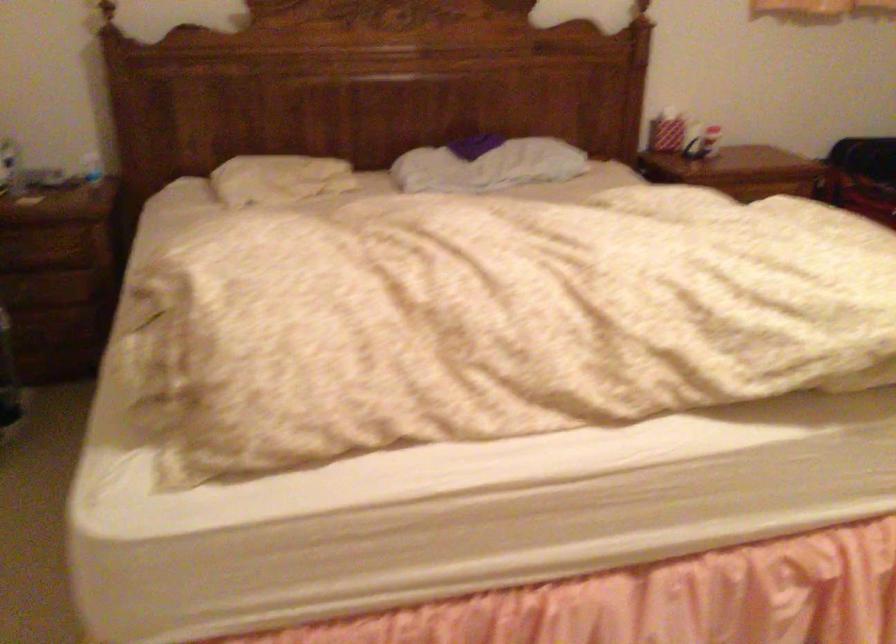
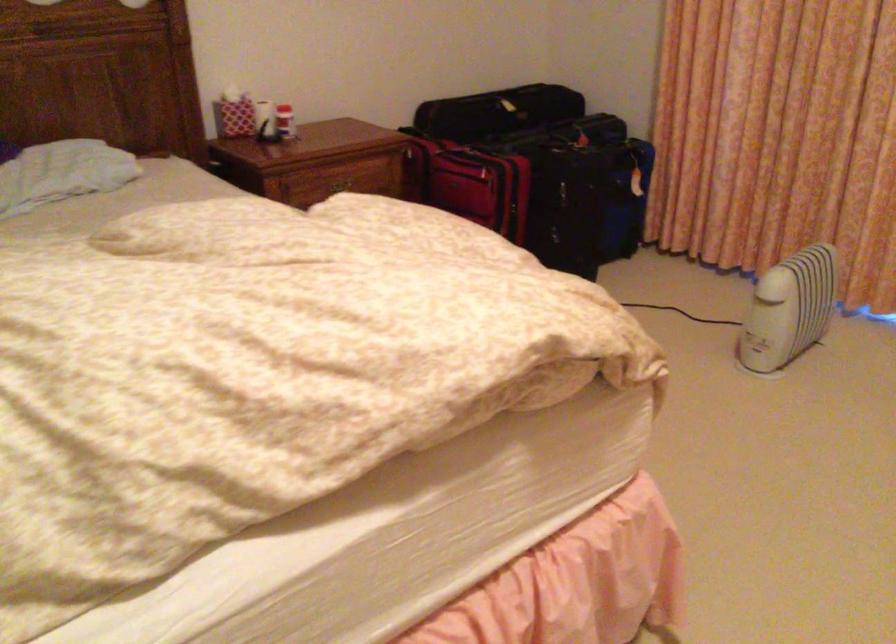
Question: I am providing you with two images of the same scene from different viewpoints. After the viewpoint changes to image2, which objects are now occluded?

Choices:
 (A) black suitcase handle
 (B) blue suitcase
 (C) wooden drawer handle
 (D) none of these

Answer: (D)